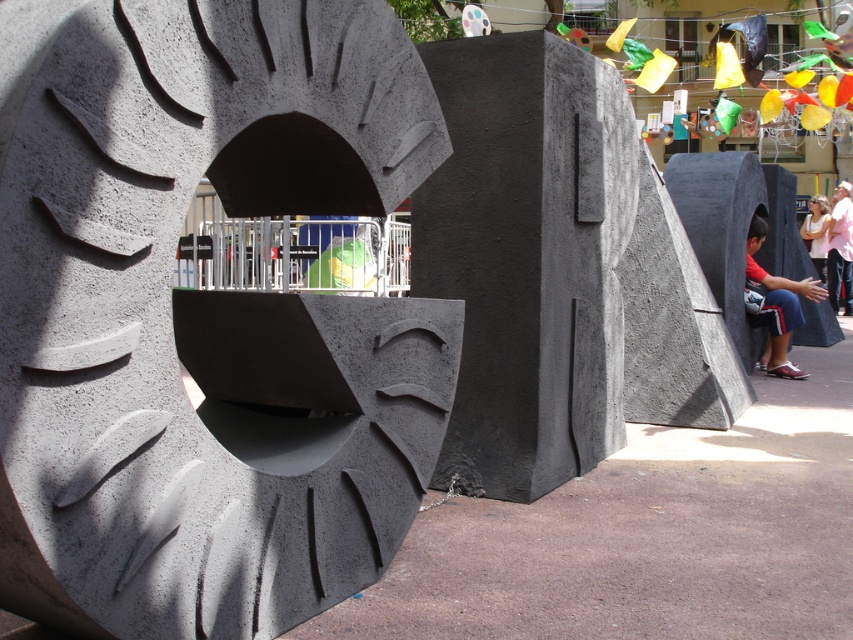
Looking at this image, you are an artist planning to photograph the matte gray tire at center and the smooth skin face at center. You need to ensure that both objects fit within the camera frame. Considering their widths, which object should you position closer to the camera to maintain their relative sizes in the photo?

Since the matte gray tire at center is wider than the smooth skin face at center, you should position the smooth skin face at center closer to the camera to make it appear larger and match the size of the matte gray tire at center in the photo.

You are standing in front of the sculptures and notice the matte gray tire at center and the smooth skin face at center. Which object is positioned to the left when viewed from your perspective?

The matte gray tire at center is to the left of the smooth skin face at center.